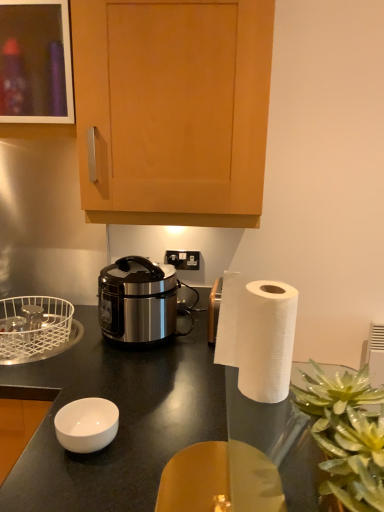
Question: Does stainless steel rice cooker at center have a larger size compared to black plastic power outlet at center?

Choices:
 (A) no
 (B) yes

Answer: (B)

Question: Does stainless steel rice cooker at center have a lesser width compared to black plastic power outlet at center?

Choices:
 (A) no
 (B) yes

Answer: (A)

Question: Does stainless steel rice cooker at center have a lesser height compared to black plastic power outlet at center?

Choices:
 (A) yes
 (B) no

Answer: (B)

Question: From the image's perspective, is stainless steel rice cooker at center located above black plastic power outlet at center?

Choices:
 (A) no
 (B) yes

Answer: (A)

Question: Does stainless steel rice cooker at center have a greater height compared to black plastic power outlet at center?

Choices:
 (A) no
 (B) yes

Answer: (B)

Question: From the image's perspective, is stainless steel rice cooker at center located above or below white glossy bowl at lower left?

Choices:
 (A) above
 (B) below

Answer: (A)

Question: From a real-world perspective, is stainless steel rice cooker at center positioned above or below white glossy bowl at lower left?

Choices:
 (A) below
 (B) above

Answer: (B)

Question: In terms of width, does stainless steel rice cooker at center look wider or thinner when compared to white glossy bowl at lower left?

Choices:
 (A) wide
 (B) thin

Answer: (A)

Question: In terms of size, does stainless steel rice cooker at center appear bigger or smaller than white glossy bowl at lower left?

Choices:
 (A) big
 (B) small

Answer: (A)

Question: Is translucent glass vase at lower right in front of or behind stainless steel rice cooker at center in the image?

Choices:
 (A) front
 (B) behind

Answer: (A)

Question: From a real-world perspective, is translucent glass vase at lower right above or below stainless steel rice cooker at center?

Choices:
 (A) below
 (B) above

Answer: (B)

Question: In terms of width, does translucent glass vase at lower right look wider or thinner when compared to stainless steel rice cooker at center?

Choices:
 (A) thin
 (B) wide

Answer: (A)

Question: In terms of size, does translucent glass vase at lower right appear bigger or smaller than stainless steel rice cooker at center?

Choices:
 (A) small
 (B) big

Answer: (A)

Question: In terms of height, does translucent glass vase at lower right look taller or shorter compared to white wire basket at left?

Choices:
 (A) tall
 (B) short

Answer: (A)

Question: From the image's perspective, is translucent glass vase at lower right positioned above or below white wire basket at left?

Choices:
 (A) below
 (B) above

Answer: (A)